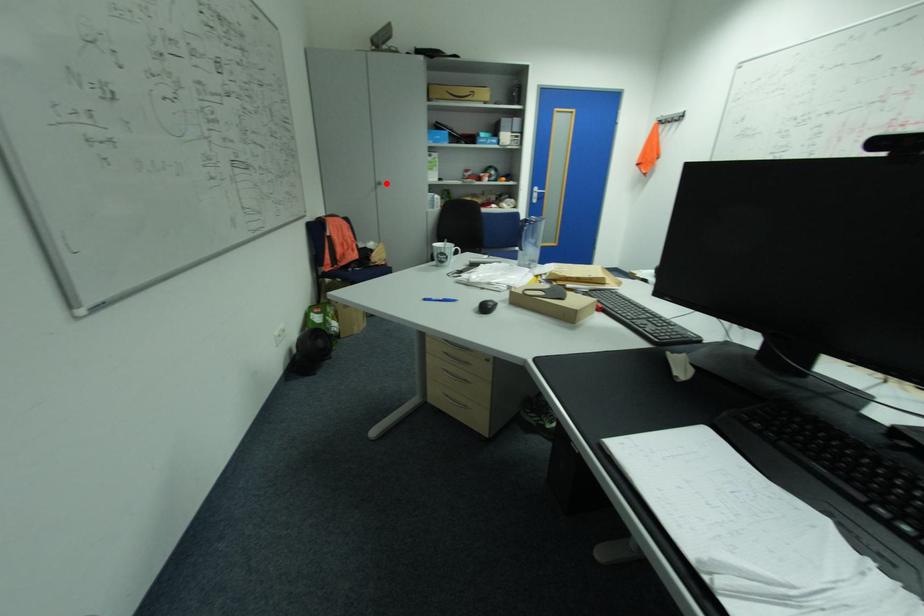
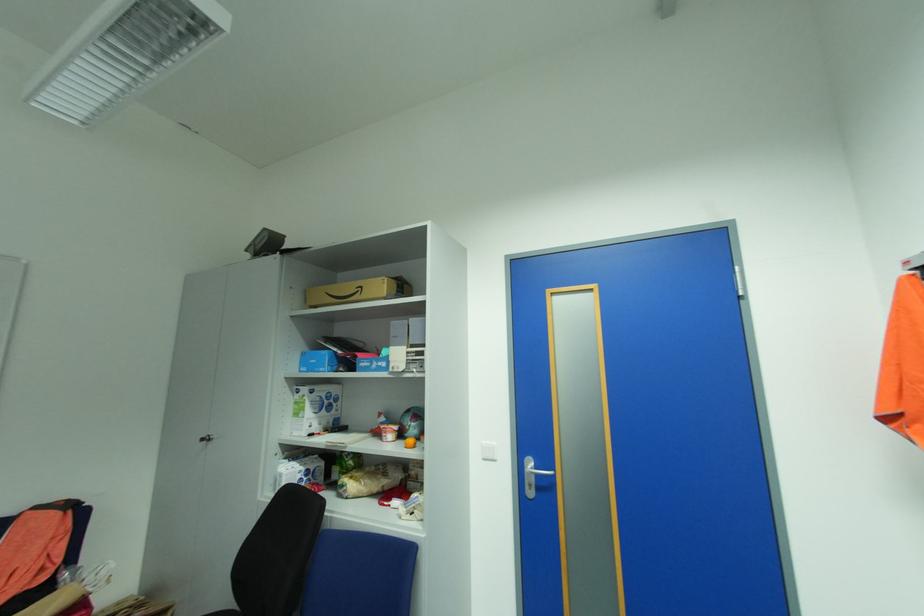
Locate, in the second image, the point that corresponds to the highlighted location in the first image.

(213, 439)